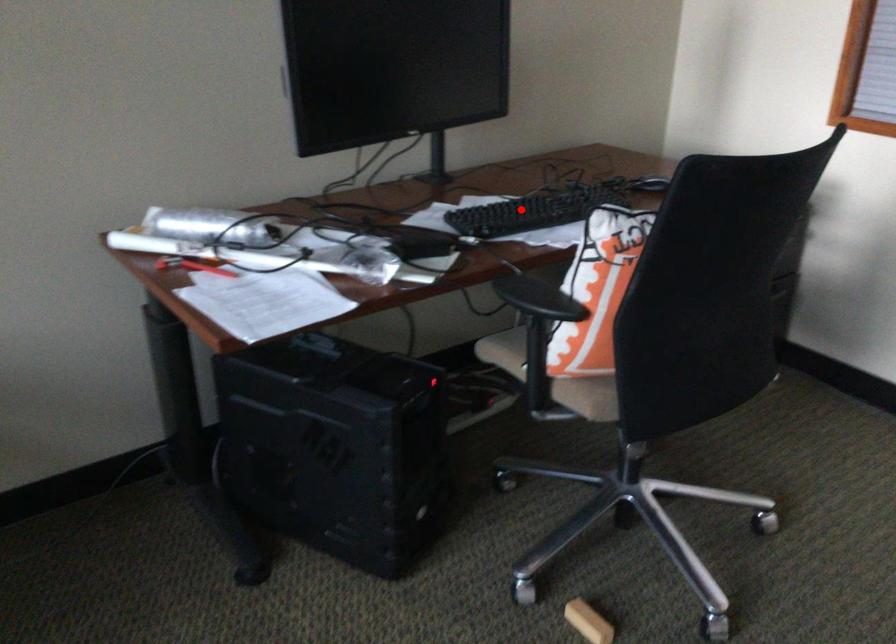
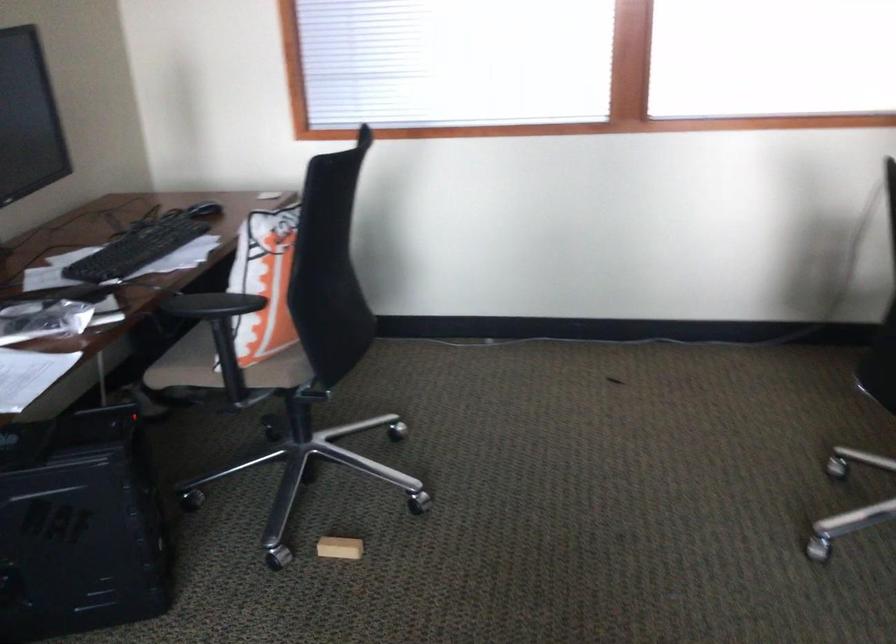
Locate, in the second image, the point that corresponds to the highlighted location in the first image.

(138, 248)